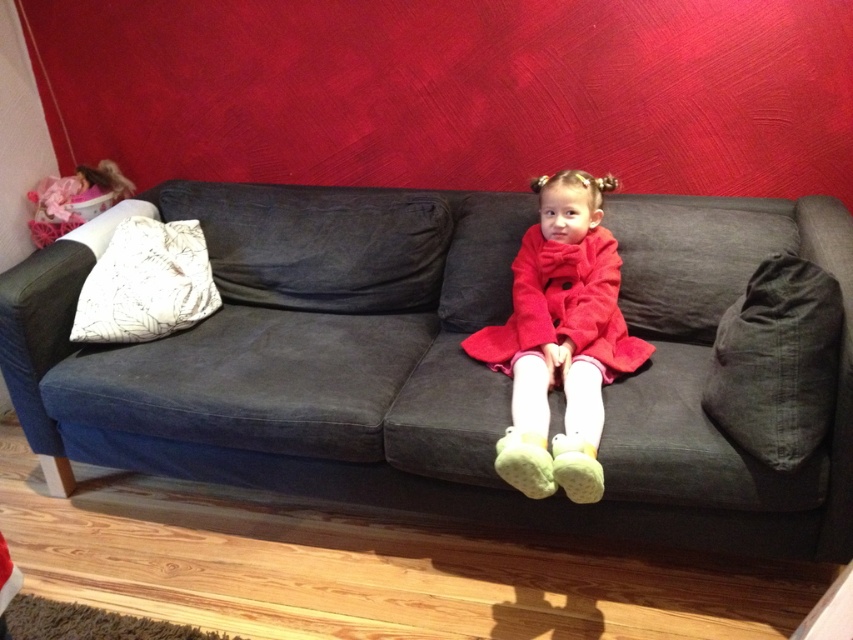
Consider the image. Between velvet red coat at center and white textured pillow at left, which one appears on the right side from the viewer's perspective?

velvet red coat at center is more to the right.

You are a GUI agent. You are given a task and a screenshot of the screen. Output one action in this format:
    pyautogui.click(x=<x>, y=<y>)
    Task: Click on the velvet red coat at center
    The width and height of the screenshot is (853, 640).
    Given the screenshot: What is the action you would take?
    pyautogui.click(x=560, y=339)

Is dark gray fabric couch at center to the right of matte pink doll at upper left from the viewer's perspective?

Yes, dark gray fabric couch at center is to the right of matte pink doll at upper left.

Describe the element at coordinates (434, 362) in the screenshot. I see `dark gray fabric couch at center` at that location.

Is point (726, 502) positioned in front of point (115, 188)?

Yes, it is in front of point (115, 188).

The width and height of the screenshot is (853, 640). Identify the location of dark gray fabric couch at center. (434, 362).

Locate an element on the screen. dark gray fabric pillow at right is located at coordinates (776, 362).

This screenshot has width=853, height=640. I want to click on dark gray fabric pillow at right, so click(776, 362).

Find the location of `dark gray fabric pillow at right`. dark gray fabric pillow at right is located at coordinates (776, 362).